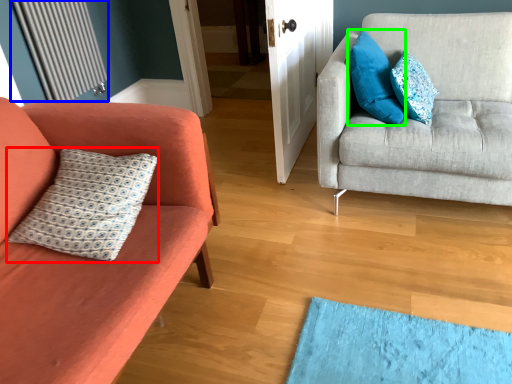
Question: Which object is positioned closest to pillow (highlighted by a red box)? Select from radiator (highlighted by a blue box) and pillow (highlighted by a green box).

Choices:
 (A) radiator
 (B) pillow

Answer: (B)